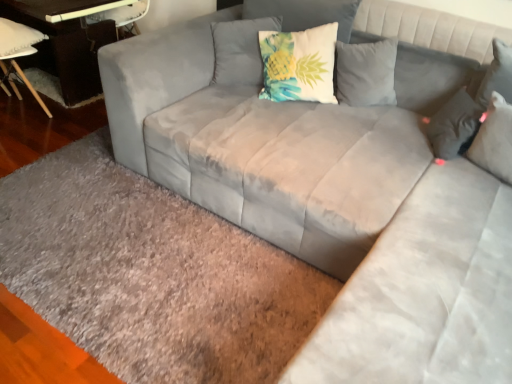
At what (x,y) coordinates should I click in order to perform the action: click on white fabric pillow with pineapple print at upper center, which appears as the second pillow when viewed from the left. Please return your answer as a coordinate pair (x, y). Looking at the image, I should click on (298, 64).

Measure the distance between point (508, 147) and camera.

The depth of point (508, 147) is 5.73 feet.

What do you see at coordinates (494, 139) in the screenshot?
I see `suede gray pillow at upper right, marked as the 3th pillow in a left-to-right arrangement` at bounding box center [494, 139].

Locate an element on the screen. white fabric chair at lower left is located at coordinates (18, 54).

From the image's perspective, which object appears higher, teal fabric pillow at upper center, the first pillow positioned from the left, or gray shaggy rug at lower left?

teal fabric pillow at upper center, the first pillow positioned from the left, appears higher in the image.

Considering the relative sizes of teal fabric pillow at upper center, the first pillow positioned from the left, and gray shaggy rug at lower left in the image provided, is teal fabric pillow at upper center, the first pillow positioned from the left, shorter than gray shaggy rug at lower left?

In fact, teal fabric pillow at upper center, the first pillow positioned from the left, may be taller than gray shaggy rug at lower left.

Is teal fabric pillow at upper center, acting as the third pillow starting from the right, to the left or to the right of gray shaggy rug at lower left in the image?

teal fabric pillow at upper center, acting as the third pillow starting from the right, is positioned on gray shaggy rug at lower left's right side.

In the scene shown: Could you tell me if teal fabric pillow at upper center, the first pillow positioned from the left, is turned towards gray shaggy rug at lower left?

No.

Which of these two, white fabric pillow with pineapple print at upper center, which appears as the second pillow when viewed from the left, or white fabric chair at lower left, stands taller?

Standing taller between the two is white fabric chair at lower left.

Can you see white fabric pillow with pineapple print at upper center, which appears as the second pillow when viewed from the left, touching white fabric chair at lower left?

There is a gap between white fabric pillow with pineapple print at upper center, which appears as the second pillow when viewed from the left, and white fabric chair at lower left.

Is white fabric pillow with pineapple print at upper center, the 2th pillow from the right, positioned with its back to white fabric chair at lower left?

That's not correct — white fabric pillow with pineapple print at upper center, the 2th pillow from the right, is not looking away from white fabric chair at lower left.

Identify the location of the 1st pillow in front of the white fabric chair at lower left, counting from the anchor's position. The width and height of the screenshot is (512, 384). (298, 64).

Based on the photo, from a real-world perspective, is gray shaggy rug at lower left physically located above or below teal fabric pillow at upper center, the first pillow positioned from the left?

gray shaggy rug at lower left is below teal fabric pillow at upper center, the first pillow positioned from the left.

Is gray shaggy rug at lower left aimed at teal fabric pillow at upper center, the first pillow positioned from the left?

No, gray shaggy rug at lower left is not aimed at teal fabric pillow at upper center, the first pillow positioned from the left.

Which of these two, gray shaggy rug at lower left or teal fabric pillow at upper center, acting as the third pillow starting from the right, stands shorter?

With less height is gray shaggy rug at lower left.

Relative to white fabric pillow with pineapple print at upper center, which appears as the second pillow when viewed from the left, is gray shaggy rug at lower left in front or behind?

Clearly, gray shaggy rug at lower left is in front of white fabric pillow with pineapple print at upper center, which appears as the second pillow when viewed from the left.

Is gray shaggy rug at lower left to the left of white fabric pillow with pineapple print at upper center, which appears as the second pillow when viewed from the left, from the viewer's perspective?

Yes, gray shaggy rug at lower left is to the left of white fabric pillow with pineapple print at upper center, which appears as the second pillow when viewed from the left.

Is gray shaggy rug at lower left directly adjacent to white fabric pillow with pineapple print at upper center, which appears as the second pillow when viewed from the left?

They are not placed beside each other.

Looking at this image, from a real-world perspective, is suede gray pillow at upper right, marked as the 3th pillow in a left-to-right arrangement, below white fabric chair at lower left?

No, from a real-world perspective, suede gray pillow at upper right, marked as the 3th pillow in a left-to-right arrangement, is not beneath white fabric chair at lower left.

Can you tell me how much suede gray pillow at upper right, marked as the 3th pillow in a left-to-right arrangement, and white fabric chair at lower left differ in facing direction?

suede gray pillow at upper right, marked as the 3th pillow in a left-to-right arrangement, and white fabric chair at lower left are facing 173 degrees away from each other.

Considering the relative sizes of suede gray pillow at upper right, marked as the 3th pillow in a left-to-right arrangement, and white fabric chair at lower left in the image provided, is suede gray pillow at upper right, marked as the 3th pillow in a left-to-right arrangement, bigger than white fabric chair at lower left?

No.

Can we say suede gray pillow at upper right, which is the first pillow from right to left, lies outside white fabric chair at lower left?

suede gray pillow at upper right, which is the first pillow from right to left, lies outside white fabric chair at lower left's area.

Is suede gray pillow at upper right, marked as the 3th pillow in a left-to-right arrangement, smaller than gray shaggy rug at lower left?

Indeed, suede gray pillow at upper right, marked as the 3th pillow in a left-to-right arrangement, has a smaller size compared to gray shaggy rug at lower left.

Considering the relative positions of suede gray pillow at upper right, which is the first pillow from right to left, and gray shaggy rug at lower left in the image provided, is suede gray pillow at upper right, which is the first pillow from right to left, in front of gray shaggy rug at lower left?

No, it is not.

Is point (502, 173) closer or farther from the camera than point (224, 281)?

Point (502, 173) appears to be closer to the viewer than point (224, 281).

Could you measure the distance between suede gray pillow at upper right, marked as the 3th pillow in a left-to-right arrangement, and gray shaggy rug at lower left?

suede gray pillow at upper right, marked as the 3th pillow in a left-to-right arrangement, and gray shaggy rug at lower left are 4.40 feet apart.

How far apart are white fabric pillow with pineapple print at upper center, which appears as the second pillow when viewed from the left, and dark brown wood table at left?

4.72 feet.

Which object is positioned more to the left, white fabric pillow with pineapple print at upper center, the 2th pillow from the right, or dark brown wood table at left?

dark brown wood table at left is more to the left.

Can you confirm if white fabric pillow with pineapple print at upper center, the 2th pillow from the right, is taller than dark brown wood table at left?

Incorrect, the height of white fabric pillow with pineapple print at upper center, the 2th pillow from the right, is not larger of that of dark brown wood table at left.

From the image's perspective, is white fabric pillow with pineapple print at upper center, which appears as the second pillow when viewed from the left, positioned above or below dark brown wood table at left?

Clearly, from the image's perspective, white fabric pillow with pineapple print at upper center, which appears as the second pillow when viewed from the left, is below dark brown wood table at left.

At what (x,y) coordinates should I click in order to perform the action: click on mat that is under the teal fabric pillow at upper center, acting as the third pillow starting from the right (from a real-world perspective). Please return your answer as a coordinate pair (x, y). The image size is (512, 384). Looking at the image, I should click on (151, 273).

From the image's perspective, starting from the white fabric chair at lower left, which pillow is the 1st one below? Please provide its 2D coordinates.

[(298, 64)]

From the image, which object appears to be nearer to suede gray pillow at upper right, marked as the 3th pillow in a left-to-right arrangement, dark brown wood table at left or gray shaggy rug at lower left?

Among the two, gray shaggy rug at lower left is located nearer to suede gray pillow at upper right, marked as the 3th pillow in a left-to-right arrangement.

From the image, which object appears to be farther from white fabric pillow with pineapple print at upper center, which appears as the second pillow when viewed from the left, white fabric chair at lower left or gray shaggy rug at lower left?

Among the two, white fabric chair at lower left is located further to white fabric pillow with pineapple print at upper center, which appears as the second pillow when viewed from the left.

From the image, which object appears to be farther from white fabric pillow with pineapple print at upper center, which appears as the second pillow when viewed from the left, teal fabric pillow at upper center, acting as the third pillow starting from the right, or gray shaggy rug at lower left?

gray shaggy rug at lower left is further to white fabric pillow with pineapple print at upper center, which appears as the second pillow when viewed from the left.

Estimate the real-world distances between objects in this image. Which object is further from suede gray pillow at upper right, which is the first pillow from right to left, gray shaggy rug at lower left or teal fabric pillow at upper center, the first pillow positioned from the left?

Among the two, gray shaggy rug at lower left is located further to suede gray pillow at upper right, which is the first pillow from right to left.

Looking at the image, which one is located closer to suede gray pillow at upper right, which is the first pillow from right to left, white fabric pillow with pineapple print at upper center, the 2th pillow from the right, or teal fabric pillow at upper center, acting as the third pillow starting from the right?

Based on the image, white fabric pillow with pineapple print at upper center, the 2th pillow from the right, appears to be nearer to suede gray pillow at upper right, which is the first pillow from right to left.

Estimate the real-world distances between objects in this image. Which object is further from white fabric chair at lower left, suede gray pillow at upper right, marked as the 3th pillow in a left-to-right arrangement, or gray shaggy rug at lower left?

Based on the image, suede gray pillow at upper right, marked as the 3th pillow in a left-to-right arrangement, appears to be further to white fabric chair at lower left.

When comparing their distances from teal fabric pillow at upper center, the first pillow positioned from the left, does gray shaggy rug at lower left or dark brown wood table at left seem further?

dark brown wood table at left lies further to teal fabric pillow at upper center, the first pillow positioned from the left, than the other object.

From the image, which object appears to be nearer to teal fabric pillow at upper center, acting as the third pillow starting from the right, white fabric pillow with pineapple print at upper center, the 2th pillow from the right, or dark brown wood table at left?

white fabric pillow with pineapple print at upper center, the 2th pillow from the right, lies closer to teal fabric pillow at upper center, acting as the third pillow starting from the right, than the other object.

Identify the location of pillow between dark brown wood table at left and white fabric pillow with pineapple print at upper center, which appears as the second pillow when viewed from the left, in the horizontal direction. This screenshot has width=512, height=384. (240, 50).

Find the location of a particular element. mat between white fabric chair at lower left and teal fabric pillow at upper center, the first pillow positioned from the left, in the horizontal direction is located at coordinates (151, 273).

Locate an element on the screen. mat between white fabric chair at lower left and white fabric pillow with pineapple print at upper center, which appears as the second pillow when viewed from the left, in the horizontal direction is located at coordinates (151, 273).

At what (x,y) coordinates should I click in order to perform the action: click on table between white fabric chair at lower left and suede gray pillow at upper right, marked as the 3th pillow in a left-to-right arrangement, in the horizontal direction. Please return your answer as a coordinate pair (x, y). Looking at the image, I should click on (66, 42).